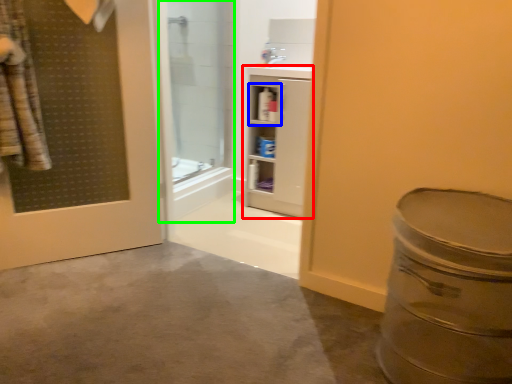
Question: Considering the real-world distances, which object is closest to bathroom cabinet (highlighted by a red box)? cabinet (highlighted by a blue box) or shower door (highlighted by a green box).

Choices:
 (A) cabinet
 (B) shower door

Answer: (A)